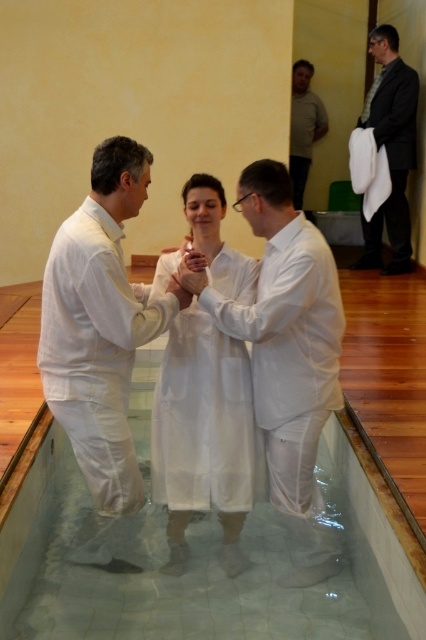
Between white matte shirt at center and white matte robe at center, which one has less height?

With less height is white matte robe at center.

Does white matte shirt at center appear on the right side of white matte robe at center?

In fact, white matte shirt at center is to the left of white matte robe at center.

You are a GUI agent. You are given a task and a screenshot of the screen. Output one action in this format:
    pyautogui.click(x=<x>, y=<y>)
    Task: Click on the white matte shirt at center
    
    Given the screenshot: What is the action you would take?
    pyautogui.click(x=100, y=339)

Is point (405, 556) positioned before point (405, 189)?

Yes, it is.

Is clear glass pool at center shorter than dark gray suit at upper right?

Correct, clear glass pool at center is not as tall as dark gray suit at upper right.

The height and width of the screenshot is (640, 426). What are the coordinates of `clear glass pool at center` in the screenshot? It's located at (374, 536).

Locate an element on the screen. clear glass pool at center is located at coordinates (374, 536).

Between white matte robe at center and light brown textured shirt at upper right, which one is positioned lower?

white matte robe at center

Based on the photo, is white matte robe at center behind light brown textured shirt at upper right?

No.

Who is more forward, (x=259, y=330) or (x=299, y=70)?

Positioned in front is point (x=259, y=330).

Where is `white matte robe at center`? The height and width of the screenshot is (640, 426). white matte robe at center is located at coordinates (290, 348).